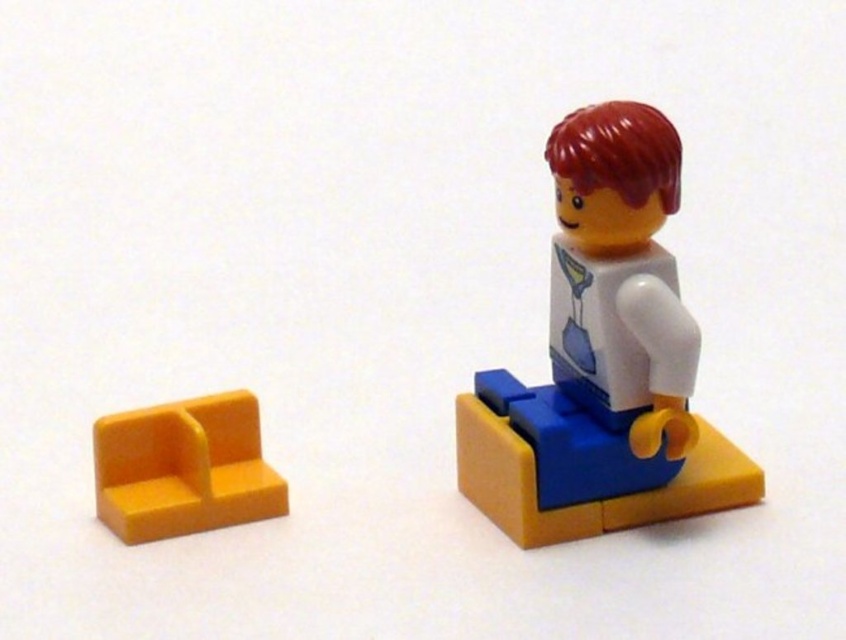
You are a LEGO enthusiast examining the image. You notice two points marked on the yellow baseplate. The first point is at coordinate point (647,499) and the second is at point (152,486). From your perspective, which point is closer to you?

Point (647,499) is in front of point (152,486), so it is closer to you.

You are a LEGO enthusiast examining a set. You see a point marked at coordinates (603,356). Based on the scene, what object is located at this point?

The point at (603,356) marks the white plastic minifigure at center.

You are a toy organizer who needs to place a white plastic minifigure at center and a yellow plastic seat at lower left into a storage box. The box has a maximum length of 40 centimeters. Can both items fit side by side in the box without overlapping?

The white plastic minifigure at center and yellow plastic seat at lower left are 40.14 centimeters apart from each other. Since the distance between them is greater than the box length of 40 centimeters, they cannot fit side by side without overlapping.